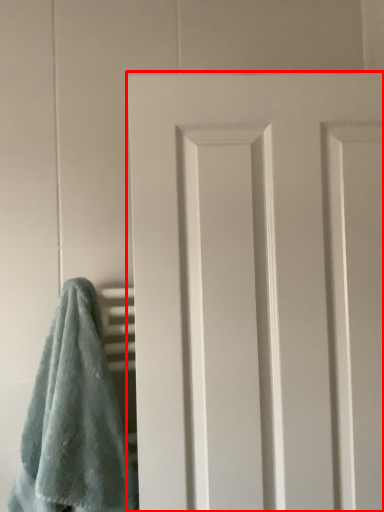
Question: From the image's perspective, what is the correct spatial relationship of door (annotated by the red box) in relation to towel?

Choices:
 (A) above
 (B) below

Answer: (A)